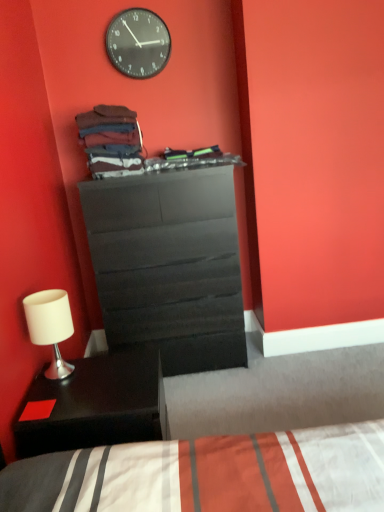
Identify the location of vacant area that is situated to the right of white matte table lamp at lower left. (106, 370).